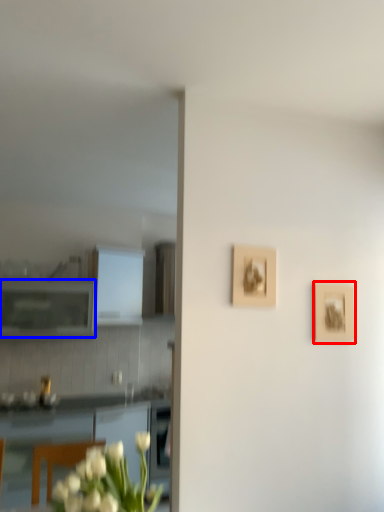
Question: Which object appears closest to the camera in this image, picture frame (highlighted by a red box) or cabinetry (highlighted by a blue box)?

Choices:
 (A) picture frame
 (B) cabinetry

Answer: (A)